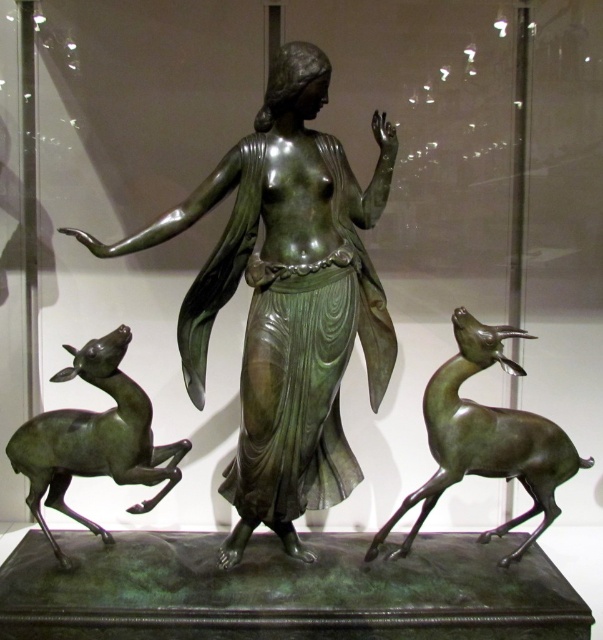
Who is more forward, [447,368] or [130,472]?

Positioned in front is point [130,472].

Can you confirm if green patina deer at right is positioned to the right of green patina deer at left?

Indeed, green patina deer at right is positioned on the right side of green patina deer at left.

Between point (368, 550) and point (107, 342), which one is positioned in front?

Point (107, 342)

In order to click on green patina deer at right in this screenshot , I will do `click(485, 438)`.

Between green patina bronze statue at center and green patina deer at right, which one is positioned higher?

Positioned higher is green patina bronze statue at center.

Is green patina bronze statue at center to the left of green patina deer at right from the viewer's perspective?

Correct, you'll find green patina bronze statue at center to the left of green patina deer at right.

Does point (265, 348) lie behind point (452, 364)?

No, (265, 348) is closer to viewer.

Locate an element on the screen. The height and width of the screenshot is (640, 603). green patina bronze statue at center is located at coordinates 286,300.

Can you confirm if green patina bronze statue at center is taller than green patina deer at left?

Indeed, green patina bronze statue at center has a greater height compared to green patina deer at left.

The image size is (603, 640). I want to click on green patina bronze statue at center, so click(x=286, y=300).